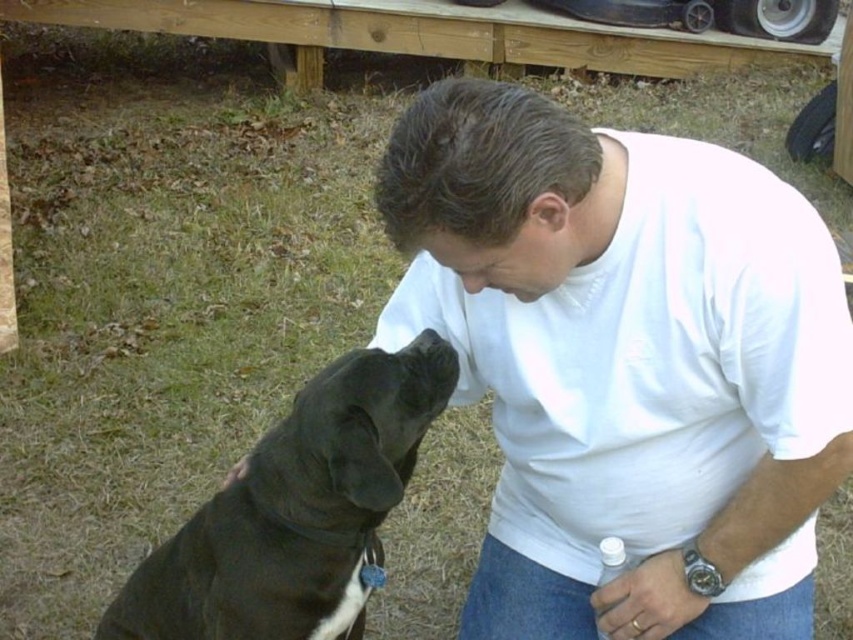
Can you confirm if black smooth dog at lower left is shorter than black matte nose at center?

No.

Who is more forward, (311, 426) or (477, 288)?

Point (477, 288)

Identify the location of black smooth dog at lower left. (297, 512).

Between white cotton shirt at center and black smooth dog at lower left, which one appears on the left side from the viewer's perspective?

black smooth dog at lower left

Which is behind, point (627, 179) or point (381, 500)?

The point (627, 179) is more distant.

Where is `white cotton shirt at center`? The width and height of the screenshot is (853, 640). white cotton shirt at center is located at coordinates (625, 362).

In order to click on white cotton shirt at center in this screenshot , I will do `click(625, 362)`.

Is black smooth dog at lower left thinner than metallic silver watch at lower right?

No, black smooth dog at lower left is not thinner than metallic silver watch at lower right.

Based on the photo, can you confirm if black smooth dog at lower left is positioned below metallic silver watch at lower right?

Yes.

Locate an element on the screen. The width and height of the screenshot is (853, 640). black smooth dog at lower left is located at coordinates (x=297, y=512).